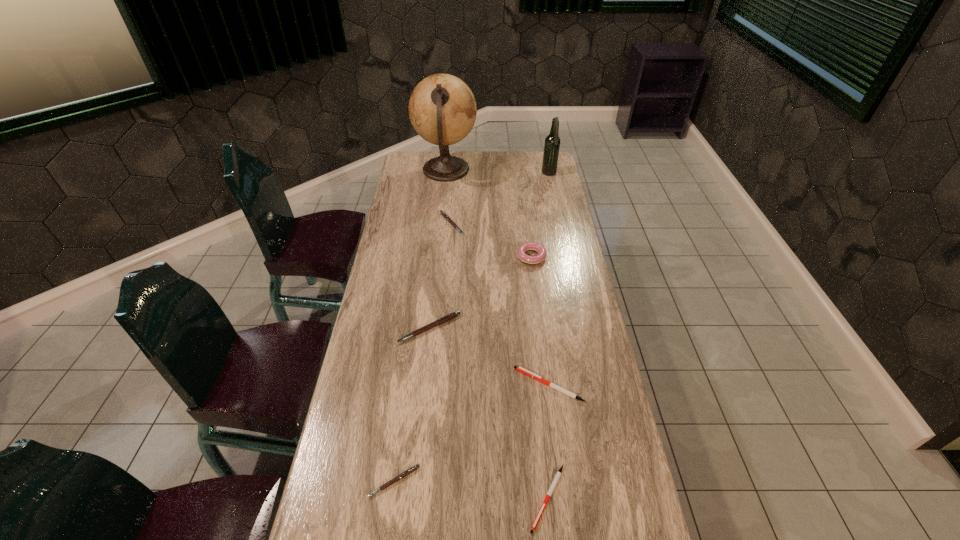
Where is `vacant space at the right edge of the desktop`? The height and width of the screenshot is (540, 960). vacant space at the right edge of the desktop is located at coordinates (591, 343).

Locate an element on the screen. blank space at the far left corner is located at coordinates (402, 172).

In the image, there is a desktop. Identify the location of blank space at the far right corner. The image size is (960, 540). (533, 153).

You are a GUI agent. You are given a task and a screenshot of the screen. Output one action in this format:
    pyautogui.click(x=<x>, y=<y>)
    Task: Click on the vacant area between the pink doughnut and the farthest pen
    This screenshot has height=540, width=960.
    Given the screenshot: What is the action you would take?
    pyautogui.click(x=492, y=240)

This screenshot has height=540, width=960. I want to click on empty space between the nearer white pen and the biggest pink pen, so click(489, 413).

Locate an element on the screen. This screenshot has width=960, height=540. free spot between the fourth farthest object and the third nearest pen is located at coordinates (540, 321).

Locate an element on the screen. The height and width of the screenshot is (540, 960). empty location between the farther white pen and the smallest pink pen is located at coordinates (471, 433).

Where is `vacant space that is in between the sixth shortest object and the biggest pink pen`? The image size is (960, 540). vacant space that is in between the sixth shortest object and the biggest pink pen is located at coordinates coord(480,293).

Find the location of a particular element. This screenshot has height=540, width=960. free area in between the globe and the fourth nearest pen is located at coordinates (438, 249).

Locate an element on the screen. This screenshot has width=960, height=540. free space between the farthest pen and the smallest pink pen is located at coordinates (423, 353).